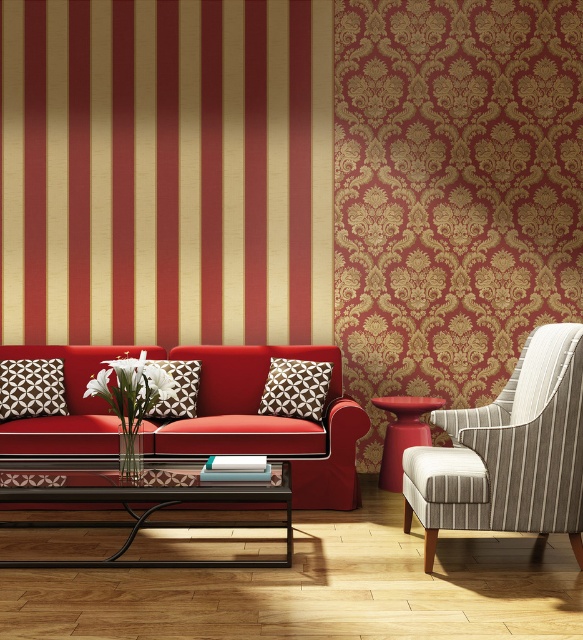
You are a guest entering the living room and want to sit on the matte red sofa at center. To reach it, you need to step over the metallic black coffee table at lower center. Considering their heights, will you be able to step over the coffee table easily?

The matte red sofa at center is taller than the metallic black coffee table at lower center, so stepping over the coffee table should be manageable as it is shorter than the sofa.

You are moving a 10 feet long sofa into the living room. The sofa is currently placed between the striped fabric armchair at right and the matte black pillow at left. Can you fit the sofa in this space without moving any existing furniture?

The distance between the striped fabric armchair at right and the matte black pillow at left is 9.29 feet, which is shorter than the 10 feet long sofa. Therefore, the sofa cannot fit in this space without moving existing furniture.

You are standing in the living room and want to place a large decorative item on the floor near the matte red sofa at center. Can you confirm if the metallic black coffee table at lower center is in the way?

The matte red sofa at center is located above the metallic black coffee table at lower center, meaning the coffee table is beneath the sofa. Since the coffee table is already positioned under the sofa, placing a large item on the floor near the sofa might be obstructed by the table. Consider moving the coffee table or choosing a smaller decorative item.